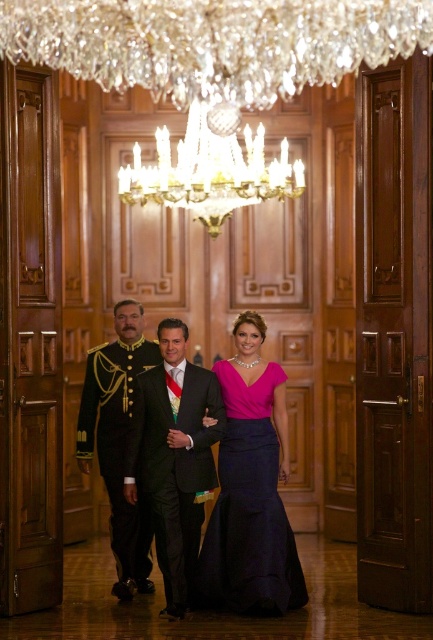
Question: Does matte pink dress at center have a larger size compared to shiny black suit at center?

Choices:
 (A) yes
 (B) no

Answer: (A)

Question: Does matte pink dress at center have a greater width compared to crystal/glass chandelier at upper center?

Choices:
 (A) yes
 (B) no

Answer: (B)

Question: Considering the relative positions of matte pink dress at center and shiny black suit at center in the image provided, where is matte pink dress at center located with respect to shiny black suit at center?

Choices:
 (A) right
 (B) left

Answer: (A)

Question: Which point is closer to the camera taking this photo?

Choices:
 (A) (186, 403)
 (B) (102, 385)
 (C) (175, 356)

Answer: (C)

Question: Which point appears farthest from the camera in this image?

Choices:
 (A) [139, 568]
 (B) [220, 179]

Answer: (B)

Question: Which object appears closest to the camera in this image?

Choices:
 (A) shiny black suit at center
 (B) shiny black uniform at center
 (C) purple satin dress at center

Answer: (C)